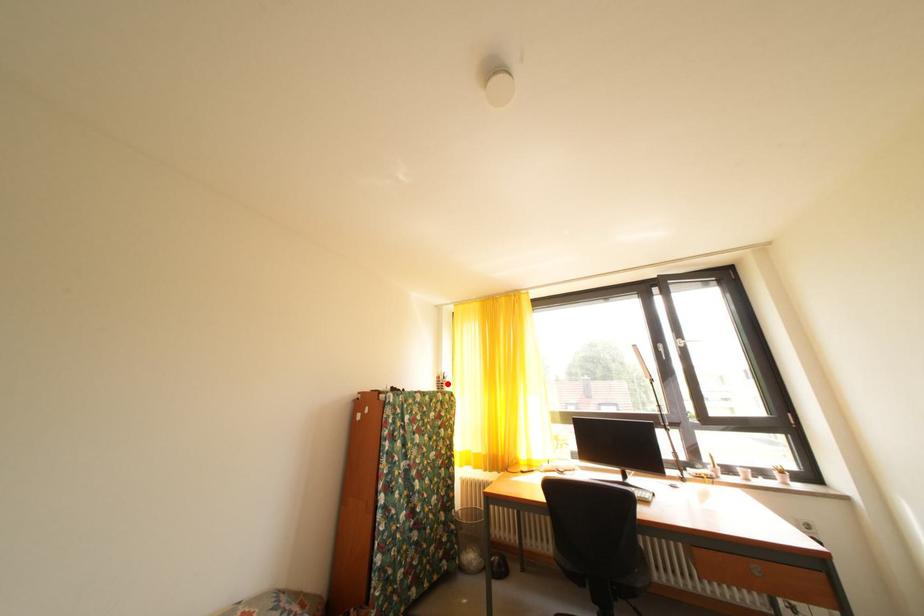
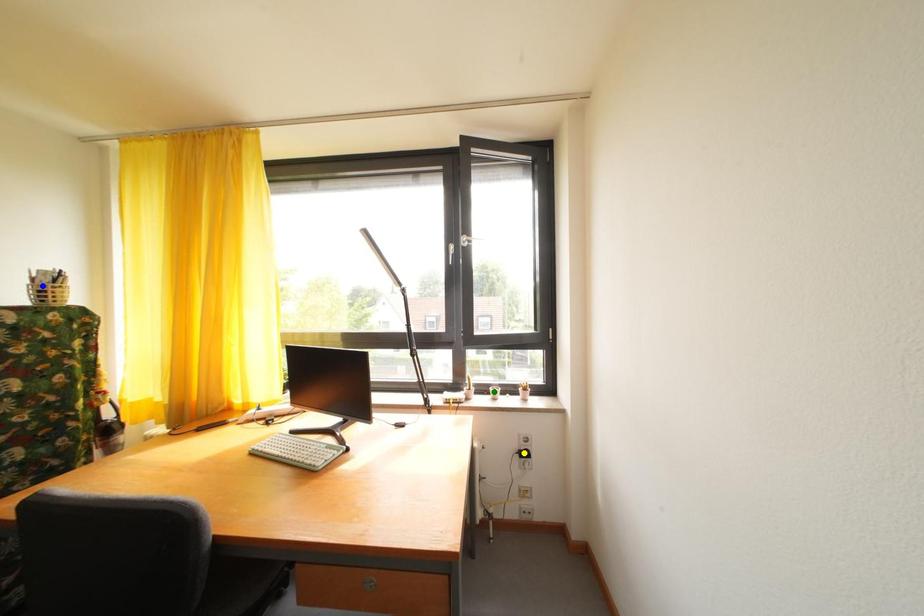
Question: I am providing you with two images of the same scene from different viewpoints. A red point is marked on the first image. You are given multiple points on the second image. Can you choose the point in image 2 that corresponds to the point in image 1?

Choices:
 (A) green point
 (B) yellow point
 (C) blue point

Answer: (C)